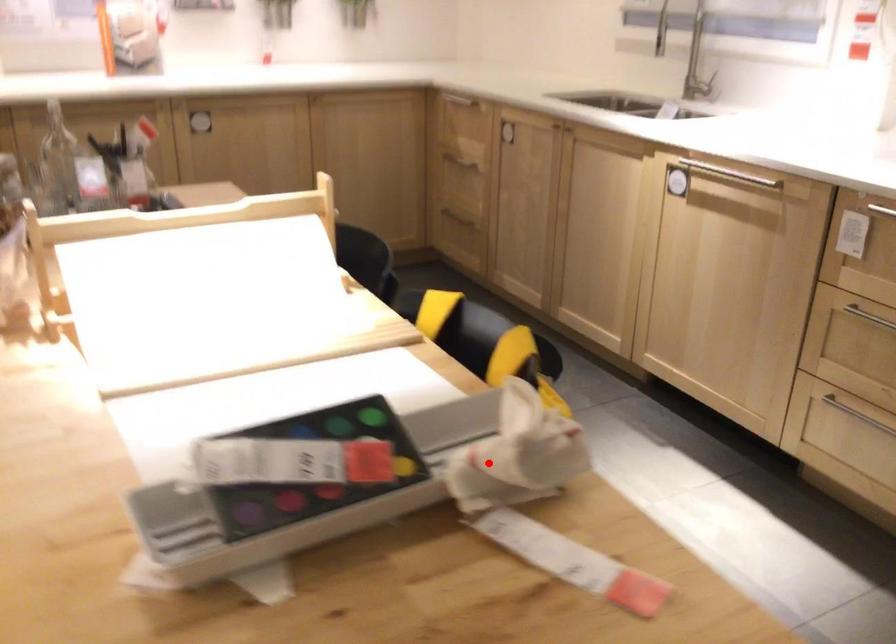
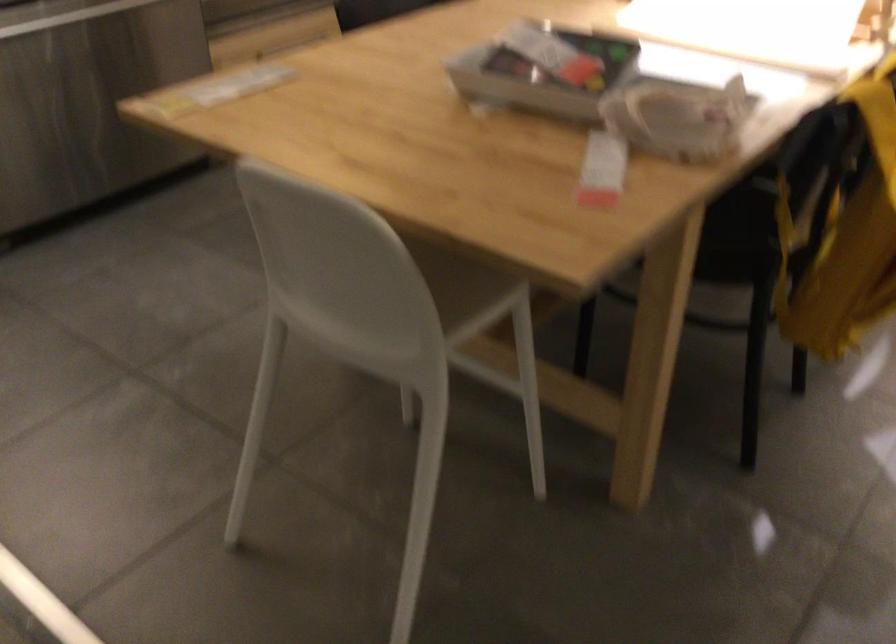
Question: I am providing you with two images of the same scene from different viewpoints. Given a red point in image1, look at the same physical point in image2. Is it:

Choices:
 (A) Closer to the viewpoint
 (B) Farther from the viewpoint

Answer: (B)